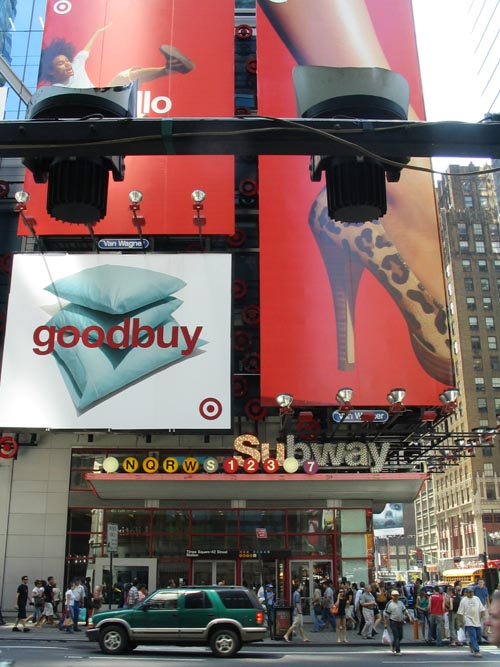
This screenshot has width=500, height=667. Identify the location of lights. (21, 191), (136, 189), (193, 191).